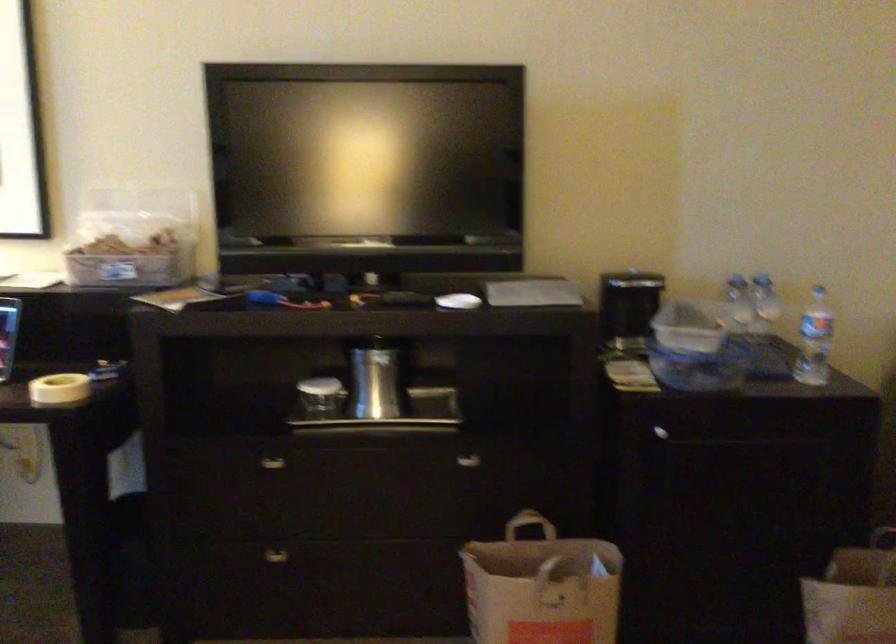
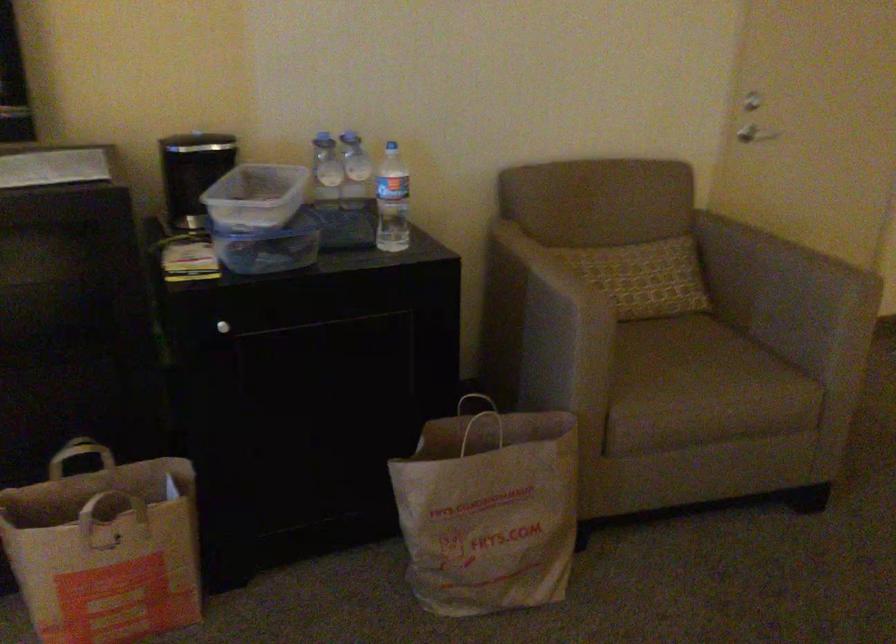
The images are taken continuously from a first-person perspective. In which direction are you moving?

The cameraman moved toward right, forward.